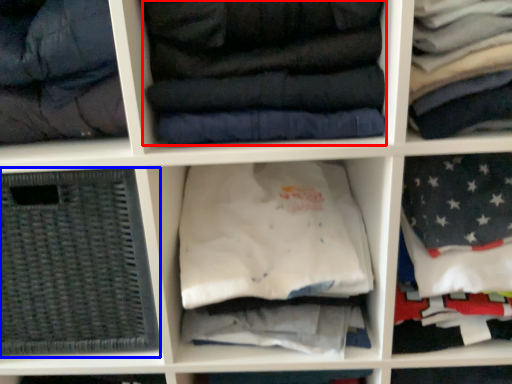
Question: Which object appears closest to the camera in this image, clothing (highlighted by a red box) or basket (highlighted by a blue box)?

Choices:
 (A) clothing
 (B) basket

Answer: (A)